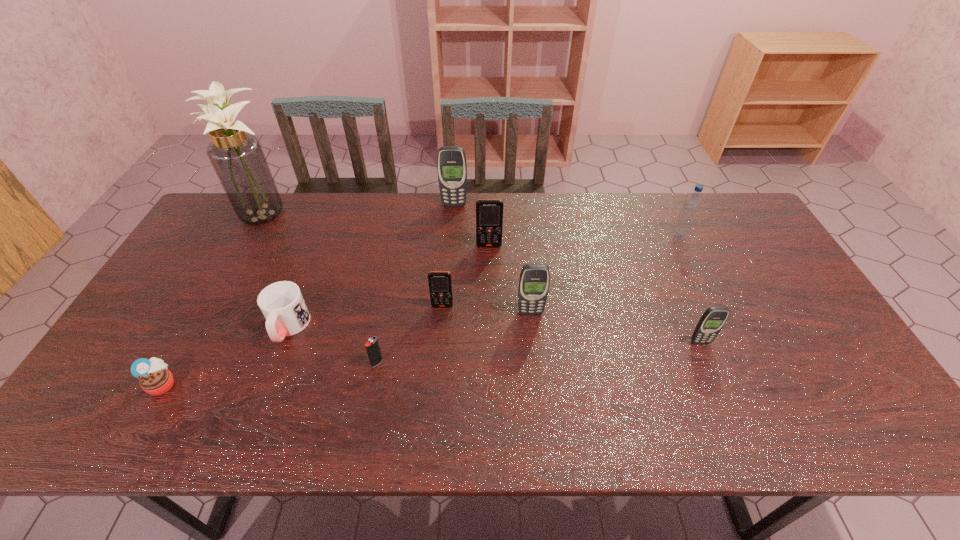
Image resolution: width=960 pixels, height=540 pixels. In order to click on vacant region located on the screen of the biggest gray cellular telephone in this screenshot , I will do `click(452, 233)`.

Image resolution: width=960 pixels, height=540 pixels. What are the coordinates of `blank area located 0.100m on the left of the blue water bottle` in the screenshot? It's located at pos(640,237).

At what (x,y) coordinates should I click in order to perform the action: click on free space located on the screen of the second farthest gray cellular telephone. Please return your answer as a coordinate pair (x, y). Looking at the image, I should click on (542, 432).

The height and width of the screenshot is (540, 960). In order to click on free space located on the screen of the fourth nearest cellular telephone in this screenshot , I will do (491, 333).

In order to click on vacant region located on the screen of the smaller orange cellular telephone in this screenshot , I will do `click(435, 409)`.

Identify the location of free location located on the screen of the second object from right to left. tap(741, 439).

Image resolution: width=960 pixels, height=540 pixels. I want to click on vacant space located 0.220m on the side of the eighth object from right to left with the handle, so click(x=249, y=433).

What are the coordinates of `vacant space positioned 0.360m on the left of the second nearest object` in the screenshot? It's located at (228, 363).

Find the location of a particular element. The width and height of the screenshot is (960, 540). vacant space located on the front-facing side of the muffin is located at coordinates (260, 384).

Locate an element on the screen. Image resolution: width=960 pixels, height=540 pixels. flower arrangement that is at the far edge is located at coordinates (237, 157).